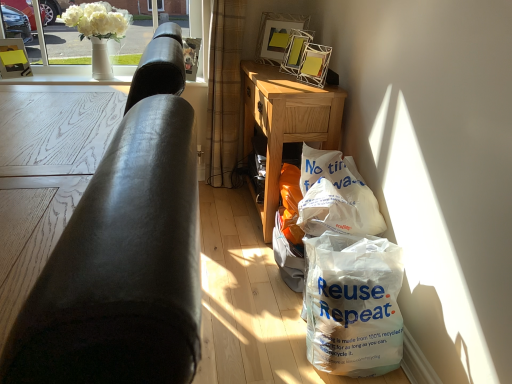
What do you see at coordinates (224, 91) in the screenshot? Image resolution: width=512 pixels, height=384 pixels. I see `plaid fabric curtain at center` at bounding box center [224, 91].

This screenshot has height=384, width=512. Find the location of `plaid fabric curtain at center`. plaid fabric curtain at center is located at coordinates (224, 91).

Locate an element on the screen. This screenshot has width=512, height=384. metallic silver picture frame at upper center, arranged as the first picture frame when viewed from the right is located at coordinates (295, 50).

What is the approximate width of white glossy picture frame at upper center, the second picture frame from the left?

4.44 inches.

At what (x,y) coordinates should I click in order to perform the action: click on black leather couch at left. Please return your answer as a coordinate pair (x, y). This screenshot has width=512, height=384. Looking at the image, I should click on (125, 252).

Measure the distance between white glass vase at upper center, positioned as the 2th window screen in right-to-left order, and white plastic bag at lower right.

They are 1.70 meters apart.

Does white glass vase at upper center, the 1th window screen from the left, appear on the left side of white plastic bag at lower right?

Indeed, white glass vase at upper center, the 1th window screen from the left, is positioned on the left side of white plastic bag at lower right.

Who is more distant, white glass vase at upper center, the 1th window screen from the left, or white plastic bag at lower right?

white glass vase at upper center, the 1th window screen from the left, is further away from the camera.

Is white glass vase at upper center, the 1th window screen from the left, with white plastic bag at lower right?

There is a gap between white glass vase at upper center, the 1th window screen from the left, and white plastic bag at lower right.

Locate an element on the screen. This screenshot has height=384, width=512. the 1st window screen behind the metallic silver picture frame at upper center, arranged as the first picture frame when viewed from the right is located at coordinates (129, 38).

In terms of width, does white ceramic vase at upper left, the 1th window screen positioned from the right, look wider or thinner when compared to metallic silver picture frame at upper center, arranged as the first picture frame when viewed from the right?

Clearly, white ceramic vase at upper left, the 1th window screen positioned from the right, has more width compared to metallic silver picture frame at upper center, arranged as the first picture frame when viewed from the right.

Is white ceramic vase at upper left, arranged as the 2th window screen when viewed from the left, beside metallic silver picture frame at upper center, arranged as the first picture frame when viewed from the right?

No, white ceramic vase at upper left, arranged as the 2th window screen when viewed from the left, is not making contact with metallic silver picture frame at upper center, arranged as the first picture frame when viewed from the right.

Can you confirm if white ceramic vase at upper left, arranged as the 2th window screen when viewed from the left, is bigger than metallic silver picture frame at upper center, arranged as the first picture frame when viewed from the right?

Indeed, white ceramic vase at upper left, arranged as the 2th window screen when viewed from the left, has a larger size compared to metallic silver picture frame at upper center, arranged as the first picture frame when viewed from the right.

From the image's perspective, is light brown wood desk at center located beneath plaid fabric curtain at center?

Yes, from the image's perspective, light brown wood desk at center is below plaid fabric curtain at center.

Between light brown wood desk at center and plaid fabric curtain at center, which one appears on the left side from the viewer's perspective?

Positioned to the left is plaid fabric curtain at center.

Does light brown wood desk at center turn towards plaid fabric curtain at center?

Yes.

From the image's perspective, who appears lower, black leather couch at left or light brown wood desk at center?

From the image's view, black leather couch at left is below.

From a real-world perspective, which object stands above the other?

black leather couch at left, from a real-world perspective.

Does black leather couch at left have a greater height compared to light brown wood desk at center?

Incorrect, the height of black leather couch at left is not larger of that of light brown wood desk at center.

Does white glossy picture frame at upper center, placed as the 2th picture frame when sorted from right to left, turn towards black leather couch at left?

Yes, white glossy picture frame at upper center, placed as the 2th picture frame when sorted from right to left, is aimed at black leather couch at left.

Does white glossy picture frame at upper center, the second picture frame from the left, have a greater width compared to black leather couch at left?

Incorrect, the width of white glossy picture frame at upper center, the second picture frame from the left, does not surpass that of black leather couch at left.

Image resolution: width=512 pixels, height=384 pixels. Find the location of `the 3rd picture frame above the black leather couch at left (from the image's perspective)`. the 3rd picture frame above the black leather couch at left (from the image's perspective) is located at coordinates (277, 35).

Which of these two, white glossy picture frame at upper center, the second picture frame from the left, or black leather couch at left, stands taller?

With more height is black leather couch at left.

How different are the orientations of plaid fabric curtain at center and white ceramic vase at upper left, arranged as the 2th window screen when viewed from the left, in degrees?

plaid fabric curtain at center and white ceramic vase at upper left, arranged as the 2th window screen when viewed from the left, are facing 0.18 degrees away from each other.

In the scene shown: Is plaid fabric curtain at center in front of or behind white ceramic vase at upper left, the 1th window screen positioned from the right, in the image?

plaid fabric curtain at center is behind white ceramic vase at upper left, the 1th window screen positioned from the right.

Locate an element on the screen. The height and width of the screenshot is (384, 512). curtain behind the white ceramic vase at upper left, arranged as the 2th window screen when viewed from the left is located at coordinates (224, 91).

Can you see plaid fabric curtain at center touching white ceramic vase at upper left, the 1th window screen positioned from the right?

No, plaid fabric curtain at center is not making contact with white ceramic vase at upper left, the 1th window screen positioned from the right.

Is white ceramic vase at upper left, the 1th window screen positioned from the right, shorter than white paper bag at lower right?

Incorrect, the height of white ceramic vase at upper left, the 1th window screen positioned from the right, does not fall short of that of white paper bag at lower right.

From the image's perspective, which one is positioned higher, white ceramic vase at upper left, arranged as the 2th window screen when viewed from the left, or white paper bag at lower right?

white ceramic vase at upper left, arranged as the 2th window screen when viewed from the left, from the image's perspective.

Looking at this image, how much distance is there between white ceramic vase at upper left, arranged as the 2th window screen when viewed from the left, and white paper bag at lower right?

white ceramic vase at upper left, arranged as the 2th window screen when viewed from the left, is 6.28 feet away from white paper bag at lower right.

Is white ceramic vase at upper left, arranged as the 2th window screen when viewed from the left, aimed at white paper bag at lower right?

No, white ceramic vase at upper left, arranged as the 2th window screen when viewed from the left, is not facing towards white paper bag at lower right.

Locate an element on the screen. This screenshot has width=512, height=384. the 2nd window screen behind when counting from the white plastic bag at lower right is located at coordinates (61, 52).

Find the location of `the 1st window screen to the left when counting from the metallic silver picture frame at upper center, which is the third picture frame in left-to-right order`. the 1st window screen to the left when counting from the metallic silver picture frame at upper center, which is the third picture frame in left-to-right order is located at coordinates (129, 38).

When comparing their distances from white glass vase at upper center, positioned as the 2th window screen in right-to-left order, does light brown wood desk at center or white glossy picture frame at upper center, placed as the 2th picture frame when sorted from right to left, seem closer?

Based on the image, white glossy picture frame at upper center, placed as the 2th picture frame when sorted from right to left, appears to be nearer to white glass vase at upper center, positioned as the 2th window screen in right-to-left order.

When comparing their distances from white glossy picture frame at upper center, the second picture frame from the left, does white paper bag at lower right or light brown wood desk at center seem further?

white paper bag at lower right lies further to white glossy picture frame at upper center, the second picture frame from the left, than the other object.

When comparing their distances from white glossy picture frame at upper center, the second picture frame from the left, does matte yellow picture frame at upper left, which is counted as the first picture frame, starting from the left, or white paper bag at lower right seem closer?

white paper bag at lower right is positioned closer to the anchor white glossy picture frame at upper center, the second picture frame from the left.

Which object lies further to the anchor point light brown wood desk at center, metallic silver picture frame at upper center, which is the third picture frame in left-to-right order, or white paper bag at lower right?

The object further to light brown wood desk at center is white paper bag at lower right.

Looking at the image, which one is located further to metallic silver picture frame at upper center, which is the third picture frame in left-to-right order, white glass vase at upper center, the 1th window screen from the left, or white paper bag at lower right?

Among the two, white glass vase at upper center, the 1th window screen from the left, is located further to metallic silver picture frame at upper center, which is the third picture frame in left-to-right order.

Based on the photo, which object lies further to the anchor point white ceramic vase at upper left, arranged as the 2th window screen when viewed from the left, black leather couch at left or matte yellow picture frame at upper left, the 3th picture frame positioned from the right?

black leather couch at left is positioned further to the anchor white ceramic vase at upper left, arranged as the 2th window screen when viewed from the left.

Looking at the image, which one is located closer to matte yellow picture frame at upper left, the 3th picture frame positioned from the right, white plastic bag at lower right or white ceramic vase at upper left, arranged as the 2th window screen when viewed from the left?

white ceramic vase at upper left, arranged as the 2th window screen when viewed from the left, is positioned closer to the anchor matte yellow picture frame at upper left, the 3th picture frame positioned from the right.

Looking at the image, which one is located closer to black leather couch at left, metallic silver picture frame at upper center, arranged as the first picture frame when viewed from the right, or matte yellow picture frame at upper left, which is counted as the first picture frame, starting from the left?

metallic silver picture frame at upper center, arranged as the first picture frame when viewed from the right, is closer to black leather couch at left.

Where is `grocery bag located between white ceramic vase at upper left, arranged as the 2th window screen when viewed from the left, and white plastic bag at lower right in the left-right direction`? This screenshot has height=384, width=512. grocery bag located between white ceramic vase at upper left, arranged as the 2th window screen when viewed from the left, and white plastic bag at lower right in the left-right direction is located at coordinates (335, 196).

The image size is (512, 384). Find the location of `desk between white ceramic vase at upper left, arranged as the 2th window screen when viewed from the left, and white plastic bag at lower right, in the horizontal direction`. desk between white ceramic vase at upper left, arranged as the 2th window screen when viewed from the left, and white plastic bag at lower right, in the horizontal direction is located at coordinates (286, 123).

The image size is (512, 384). I want to click on window screen between black leather couch at left and white glass vase at upper center, positioned as the 2th window screen in right-to-left order, from front to back, so click(129, 38).

You are a GUI agent. You are given a task and a screenshot of the screen. Output one action in this format:
    pyautogui.click(x=<x>, y=<y>)
    Task: Click on the grocery bag between matte yellow picture frame at upper left, which is counted as the first picture frame, starting from the left, and white plastic bag at lower right
    The height and width of the screenshot is (384, 512).
    Given the screenshot: What is the action you would take?
    pyautogui.click(x=335, y=196)